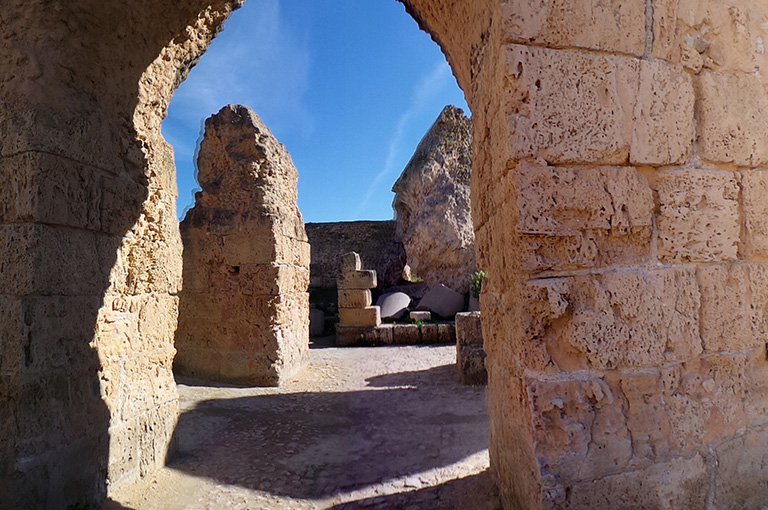
Locate an element on the screen. This screenshot has height=510, width=768. archway is located at coordinates (200, 21), (458, 53).